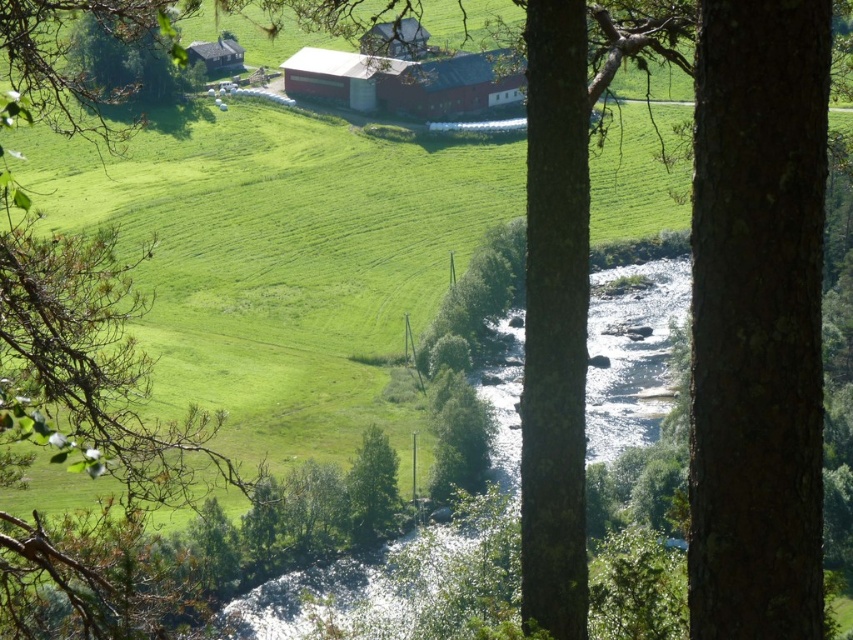
Question: Which is nearer to the green leafy tree at center?

Choices:
 (A) wooden cabin at upper left
 (B) red matte barn at center

Answer: (B)

Question: Which object appears closest to the camera in this image?

Choices:
 (A) wooden cabin at upper left
 (B) brown rough bark tree at center right
 (C) red matte barn at center
 (D) green leafy tree at center

Answer: (B)

Question: Is red matte barn at center in front of green leafy tree at center?

Choices:
 (A) no
 (B) yes

Answer: (A)

Question: Is brown rough bark tree at center right above green leafy tree at center?

Choices:
 (A) no
 (B) yes

Answer: (B)

Question: Estimate the real-world distances between objects in this image. Which object is farther from the wooden cabin at upper left?

Choices:
 (A) red matte barn at center
 (B) brown rough bark tree at center right
 (C) green leafy tree at center

Answer: (B)

Question: In this image, where is green leafy tree at center located relative to wooden cabin at upper left?

Choices:
 (A) above
 (B) below

Answer: (B)